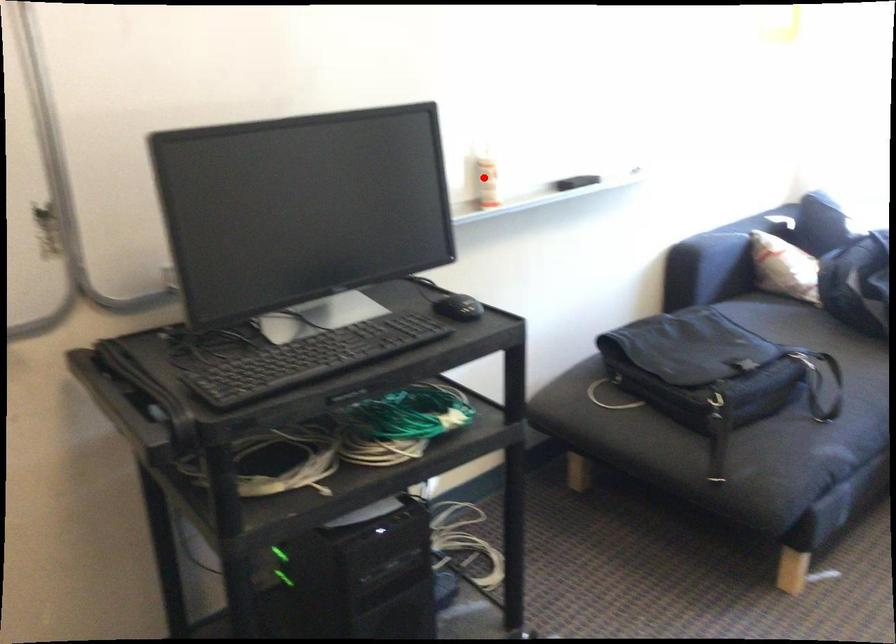
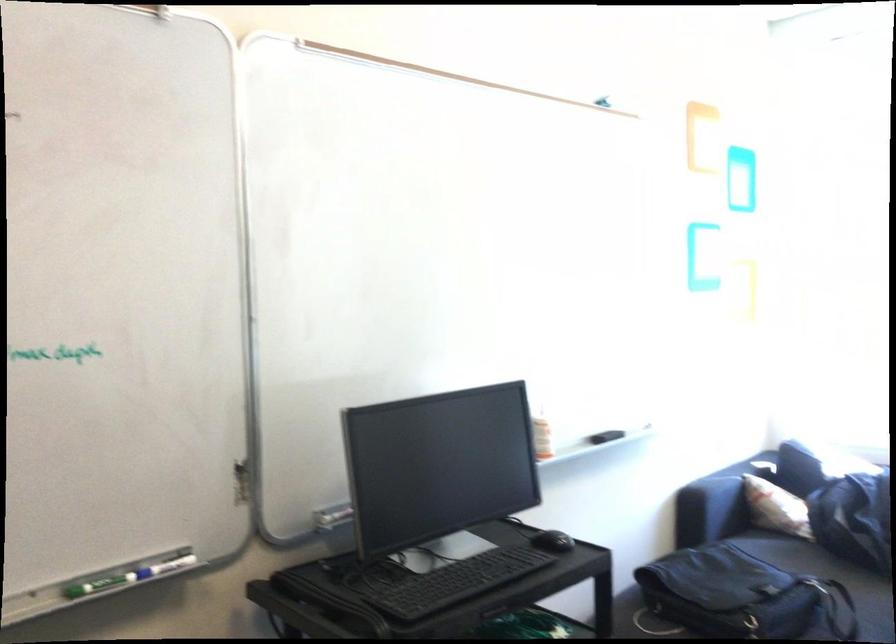
Question: I am providing you with two images of the same scene from different viewpoints. Given a red point in image1, look at the same physical point in image2. Is it:

Choices:
 (A) Closer to the viewpoint
 (B) Farther from the viewpoint

Answer: (B)